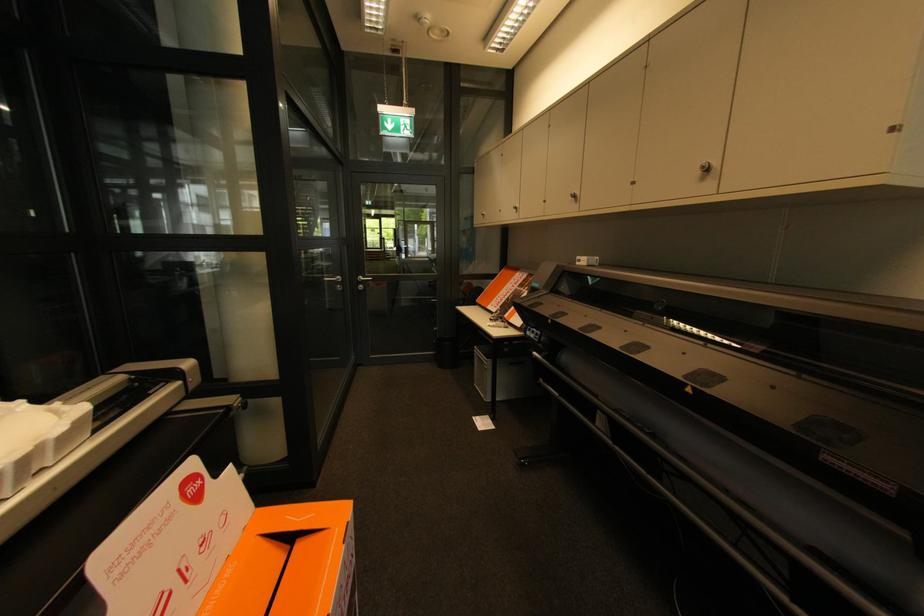
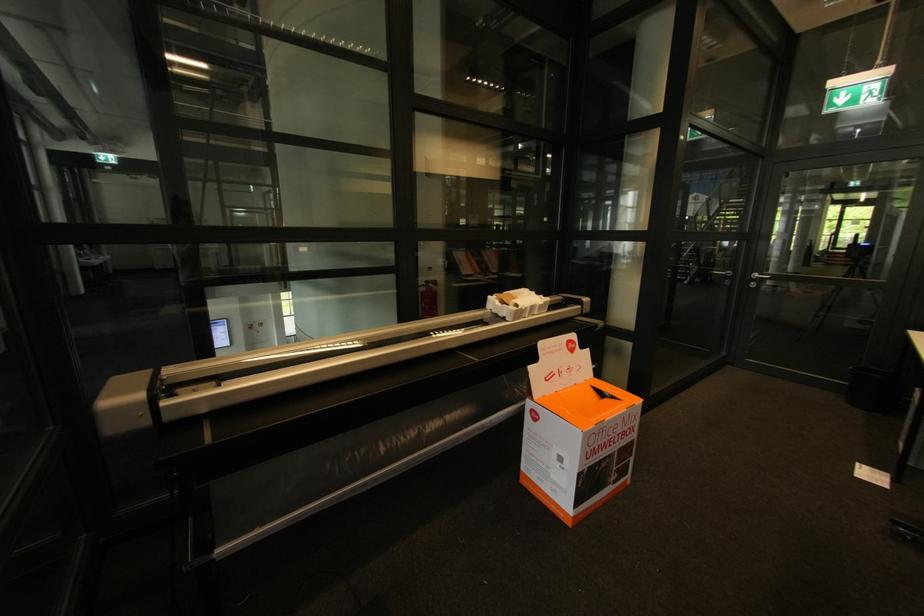
Question: The camera is either moving clockwise (left) or counter-clockwise (right) around the object. The first image is from the beginning of the video and the second image is from the end. Is the camera moving left or right when shooting the video?

Choices:
 (A) Left
 (B) Right

Answer: (B)